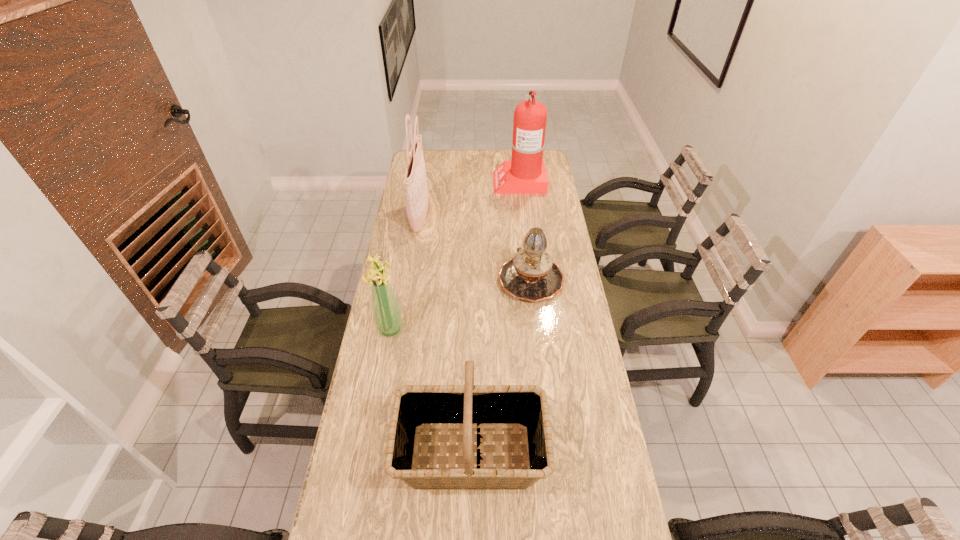
The height and width of the screenshot is (540, 960). Find the location of `the farthest object`. the farthest object is located at coordinates (525, 174).

Identify the location of the fourth nearest object. This screenshot has height=540, width=960. (415, 177).

You are a GUI agent. You are given a task and a screenshot of the screen. Output one action in this format:
    pyautogui.click(x=<x>, y=<y>)
    Task: Click on the fourth farthest object
    The image size is (960, 540).
    Given the screenshot: What is the action you would take?
    pyautogui.click(x=387, y=316)

Find the location of a particular element. This screenshot has width=960, height=540. the nearest object is located at coordinates (467, 408).

The image size is (960, 540). In order to click on the shortest object in this screenshot , I will do (x=531, y=275).

You are a GUI agent. You are given a task and a screenshot of the screen. Output one action in this format:
    pyautogui.click(x=<x>, y=<y>)
    Task: Click on the third nearest object
    The height and width of the screenshot is (540, 960).
    Given the screenshot: What is the action you would take?
    pyautogui.click(x=531, y=275)

I want to click on free space located on the front-facing side of the fire extinguisher, so click(443, 181).

This screenshot has height=540, width=960. Find the location of `vacant space located on the front-facing side of the fire extinguisher`. vacant space located on the front-facing side of the fire extinguisher is located at coordinates (416, 181).

Where is `free region located 0.290m on the front-facing side of the fire extinguisher`? free region located 0.290m on the front-facing side of the fire extinguisher is located at coordinates (437, 181).

Find the location of a particular element. This screenshot has width=960, height=540. vacant space situated on the right of the shopping bag is located at coordinates (462, 218).